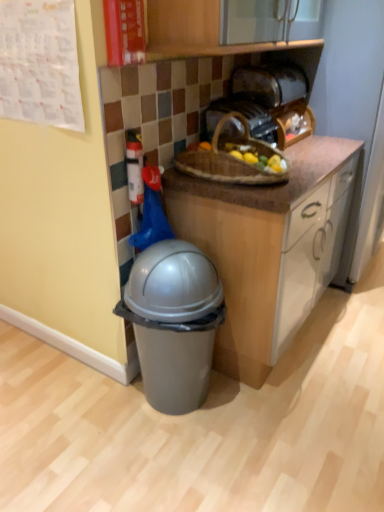
In order to face wooden basket at upper center, arranged as the 1th toaster when ordered from the bottom, should I rotate leftwards or rightwards?

Rotate your view right by about 6.626°.

Describe the element at coordinates (270, 84) in the screenshot. I see `satin gold toaster at upper center, the second toaster ordered from the bottom` at that location.

The height and width of the screenshot is (512, 384). I want to click on white plastic fire extinguisher at upper left, so click(x=134, y=166).

Locate an element on the screen. gray plastic trash can at lower left is located at coordinates (174, 322).

Locate an element on the screen. The image size is (384, 512). brown woven picnic basket at center is located at coordinates (232, 158).

From the image's perspective, between satin gold toaster at upper center, placed as the first toaster when sorted from top to bottom, and wooden basket at upper center, which appears as the second toaster when viewed from the top, which one is located above?

satin gold toaster at upper center, placed as the first toaster when sorted from top to bottom, is shown above in the image.

Considering the sizes of objects satin gold toaster at upper center, placed as the first toaster when sorted from top to bottom, and wooden basket at upper center, arranged as the 1th toaster when ordered from the bottom, in the image provided, who is smaller, satin gold toaster at upper center, placed as the first toaster when sorted from top to bottom, or wooden basket at upper center, arranged as the 1th toaster when ordered from the bottom,?

wooden basket at upper center, arranged as the 1th toaster when ordered from the bottom, is smaller.

Which is behind, satin gold toaster at upper center, the second toaster ordered from the bottom, or wooden basket at upper center, arranged as the 1th toaster when ordered from the bottom?

satin gold toaster at upper center, the second toaster ordered from the bottom, is further from the camera.

From the image's perspective, which one is positioned higher, brown woven picnic basket at center or white plastic fire extinguisher at upper left?

brown woven picnic basket at center appears higher in the image.

The width and height of the screenshot is (384, 512). What are the coordinates of `toy that is below the brown woven picnic basket at center (from the image's perspective)` in the screenshot? It's located at (134, 166).

Is point (200, 162) less distant than point (134, 162)?

No.

Is the surface of brown woven picnic basket at center in direct contact with white plastic fire extinguisher at upper left?

No, brown woven picnic basket at center is not in contact with white plastic fire extinguisher at upper left.

How many degrees apart are the facing directions of wooden basket at upper center, arranged as the 1th toaster when ordered from the bottom, and brown woven picnic basket at center?

There is a 2.61-degree angle between the facing directions of wooden basket at upper center, arranged as the 1th toaster when ordered from the bottom, and brown woven picnic basket at center.

From a real-world perspective, is wooden basket at upper center, which appears as the second toaster when viewed from the top, positioned above or below brown woven picnic basket at center?

From a real-world perspective, wooden basket at upper center, which appears as the second toaster when viewed from the top, is physically above brown woven picnic basket at center.

Is wooden basket at upper center, arranged as the 1th toaster when ordered from the bottom, positioned in front of brown woven picnic basket at center?

No, the depth of wooden basket at upper center, arranged as the 1th toaster when ordered from the bottom, is greater than that of brown woven picnic basket at center.

Does wooden basket at upper center, arranged as the 1th toaster when ordered from the bottom, have a greater width compared to brown woven picnic basket at center?

Incorrect, the width of wooden basket at upper center, arranged as the 1th toaster when ordered from the bottom, does not surpass that of brown woven picnic basket at center.

Can we say gray plastic trash can at lower left lies outside wooden basket at upper center, which appears as the second toaster when viewed from the top?

Yes, gray plastic trash can at lower left is located beyond the bounds of wooden basket at upper center, which appears as the second toaster when viewed from the top.

Considering the positions of objects gray plastic trash can at lower left and wooden basket at upper center, which appears as the second toaster when viewed from the top, in the image provided, who is more to the left, gray plastic trash can at lower left or wooden basket at upper center, which appears as the second toaster when viewed from the top,?

gray plastic trash can at lower left.

Is gray plastic trash can at lower left shorter than wooden basket at upper center, which appears as the second toaster when viewed from the top?

Incorrect, the height of gray plastic trash can at lower left does not fall short of that of wooden basket at upper center, which appears as the second toaster when viewed from the top.

How different are the orientations of gray plastic trash can at lower left and wooden basket at upper center, which appears as the second toaster when viewed from the top, in degrees?

The facing directions of gray plastic trash can at lower left and wooden basket at upper center, which appears as the second toaster when viewed from the top, are 2.82 degrees apart.

Does point (265, 120) come closer to viewer compared to point (128, 177)?

No, (265, 120) is behind (128, 177).

How different are the orientations of wooden basket at upper center, arranged as the 1th toaster when ordered from the bottom, and white plastic fire extinguisher at upper left in degrees?

The facing directions of wooden basket at upper center, arranged as the 1th toaster when ordered from the bottom, and white plastic fire extinguisher at upper left are 3 degrees apart.

Which object is closer to the camera, wooden basket at upper center, arranged as the 1th toaster when ordered from the bottom, or white plastic fire extinguisher at upper left?

Positioned in front is white plastic fire extinguisher at upper left.

Which is correct: wooden basket at upper center, which appears as the second toaster when viewed from the top, is inside white plastic fire extinguisher at upper left, or outside of it?

wooden basket at upper center, which appears as the second toaster when viewed from the top, cannot be found inside white plastic fire extinguisher at upper left.

Is white plastic fire extinguisher at upper left beside gray plastic trash can at lower left?

white plastic fire extinguisher at upper left is not next to gray plastic trash can at lower left, and they're not touching.

From the image's perspective, is white plastic fire extinguisher at upper left on gray plastic trash can at lower left?

Yes.

At what (x,y) coordinates should I click in order to perform the action: click on trash bin/can in front of the white plastic fire extinguisher at upper left. Please return your answer as a coordinate pair (x, y). The image size is (384, 512). Looking at the image, I should click on click(174, 322).

From a real-world perspective, which is physically above, white plastic fire extinguisher at upper left or gray plastic trash can at lower left?

white plastic fire extinguisher at upper left, from a real-world perspective.

Is wooden basket at upper center, arranged as the 1th toaster when ordered from the bottom, completely or partially outside of gray plastic trash can at lower left?

Yes.

Considering the sizes of objects wooden basket at upper center, which appears as the second toaster when viewed from the top, and gray plastic trash can at lower left in the image provided, who is shorter, wooden basket at upper center, which appears as the second toaster when viewed from the top, or gray plastic trash can at lower left?

Standing shorter between the two is wooden basket at upper center, which appears as the second toaster when viewed from the top.

Considering the positions of point (278, 131) and point (198, 341), is point (278, 131) closer or farther from the camera than point (198, 341)?

Clearly, point (278, 131) is more distant from the camera than point (198, 341).

Locate an element on the screen. This screenshot has width=384, height=512. the 1st toaster to the right of the gray plastic trash can at lower left, starting your count from the anchor is located at coordinates (246, 119).

This screenshot has width=384, height=512. In order to click on toaster that appears above the wooden basket at upper center, arranged as the 1th toaster when ordered from the bottom (from the image's perspective) in this screenshot , I will do `click(270, 84)`.

Where is `picnic basket in front of the white plastic fire extinguisher at upper left`? The height and width of the screenshot is (512, 384). picnic basket in front of the white plastic fire extinguisher at upper left is located at coordinates (232, 158).

From the image, which object appears to be farther from brown woven picnic basket at center, white plastic fire extinguisher at upper left or gray plastic trash can at lower left?

Among the two, gray plastic trash can at lower left is located further to brown woven picnic basket at center.

Estimate the real-world distances between objects in this image. Which object is closer to white plastic fire extinguisher at upper left, wooden basket at upper center, arranged as the 1th toaster when ordered from the bottom, or satin gold toaster at upper center, placed as the first toaster when sorted from top to bottom?

wooden basket at upper center, arranged as the 1th toaster when ordered from the bottom, is closer to white plastic fire extinguisher at upper left.

Looking at the image, which one is located further to gray plastic trash can at lower left, satin gold toaster at upper center, placed as the first toaster when sorted from top to bottom, or brown woven picnic basket at center?

satin gold toaster at upper center, placed as the first toaster when sorted from top to bottom, lies further to gray plastic trash can at lower left than the other object.

Which object lies further to the anchor point gray plastic trash can at lower left, white plastic fire extinguisher at upper left or satin gold toaster at upper center, the second toaster ordered from the bottom?

Among the two, satin gold toaster at upper center, the second toaster ordered from the bottom, is located further to gray plastic trash can at lower left.

Which object lies nearer to the anchor point wooden basket at upper center, which appears as the second toaster when viewed from the top, brown woven picnic basket at center or gray plastic trash can at lower left?

brown woven picnic basket at center is positioned closer to the anchor wooden basket at upper center, which appears as the second toaster when viewed from the top.

From the image, which object appears to be nearer to white plastic fire extinguisher at upper left, brown woven picnic basket at center or satin gold toaster at upper center, placed as the first toaster when sorted from top to bottom?

Among the two, brown woven picnic basket at center is located nearer to white plastic fire extinguisher at upper left.

Estimate the real-world distances between objects in this image. Which object is further from white plastic fire extinguisher at upper left, gray plastic trash can at lower left or satin gold toaster at upper center, placed as the first toaster when sorted from top to bottom?

satin gold toaster at upper center, placed as the first toaster when sorted from top to bottom, is further to white plastic fire extinguisher at upper left.

Estimate the real-world distances between objects in this image. Which object is closer to white plastic fire extinguisher at upper left, satin gold toaster at upper center, placed as the first toaster when sorted from top to bottom, or brown woven picnic basket at center?

brown woven picnic basket at center.

Where is `toy between wooden basket at upper center, arranged as the 1th toaster when ordered from the bottom, and gray plastic trash can at lower left in the up-down direction`? toy between wooden basket at upper center, arranged as the 1th toaster when ordered from the bottom, and gray plastic trash can at lower left in the up-down direction is located at coordinates (134, 166).

Locate an element on the screen. picnic basket between satin gold toaster at upper center, placed as the first toaster when sorted from top to bottom, and gray plastic trash can at lower left vertically is located at coordinates (232, 158).

At what (x,y) coordinates should I click in order to perform the action: click on toaster between brown woven picnic basket at center and satin gold toaster at upper center, the second toaster ordered from the bottom, along the z-axis. Please return your answer as a coordinate pair (x, y). The width and height of the screenshot is (384, 512). Looking at the image, I should click on (246, 119).

The image size is (384, 512). I want to click on picnic basket between white plastic fire extinguisher at upper left and satin gold toaster at upper center, placed as the first toaster when sorted from top to bottom, so click(232, 158).